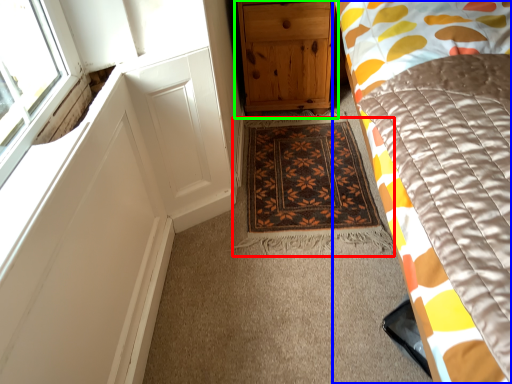
Question: Considering the real-world distances, which object is farthest from mat (highlighted by a red box)? bed (highlighted by a blue box) or chest of drawers (highlighted by a green box)?

Choices:
 (A) bed
 (B) chest of drawers

Answer: (A)